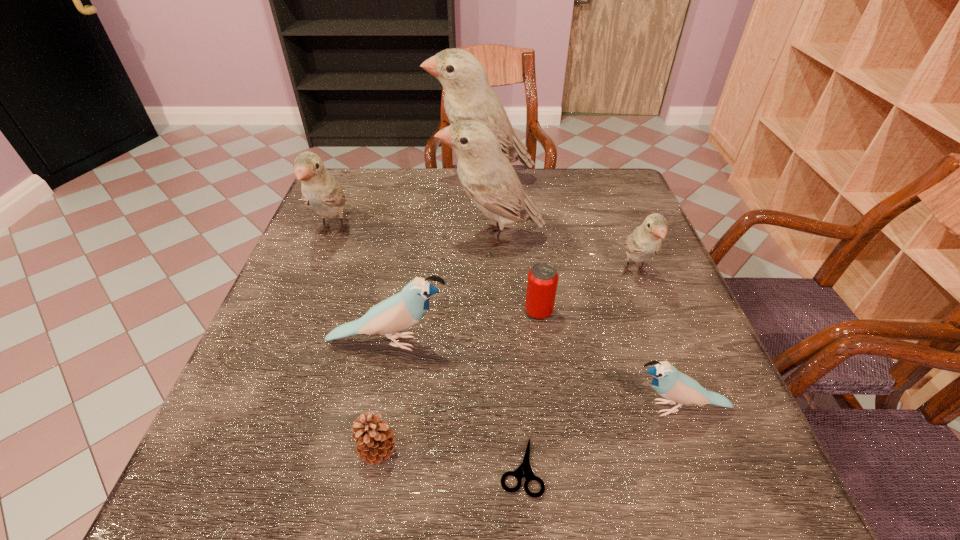
Where is `pinecone situated at the near edge`? pinecone situated at the near edge is located at coordinates (375, 441).

You are a GUI agent. You are given a task and a screenshot of the screen. Output one action in this format:
    pyautogui.click(x=<x>, y=<y>)
    Task: Click on the shears at the near edge
    The image size is (960, 540).
    Given the screenshot: What is the action you would take?
    pyautogui.click(x=524, y=469)

Where is `object located at the far left corner`? object located at the far left corner is located at coordinates (320, 190).

Identify the location of vacant space at the far edge of the desktop. (458, 202).

This screenshot has height=540, width=960. In order to click on free spot at the left edge of the desktop in this screenshot , I will do point(266,442).

The image size is (960, 540). Identify the location of blank area at the right edge. (666, 308).

I want to click on vacant space at the far left corner, so click(x=348, y=173).

In the image, there is a desktop. Identify the location of vacant space at the far right corner. This screenshot has width=960, height=540. click(x=595, y=168).

The width and height of the screenshot is (960, 540). Find the location of `blank space at the near right corner of the desktop`. blank space at the near right corner of the desktop is located at coordinates (734, 483).

Locate an element on the screen. The height and width of the screenshot is (540, 960). unoccupied position between the smallest white bird and the sixth farthest object is located at coordinates (511, 308).